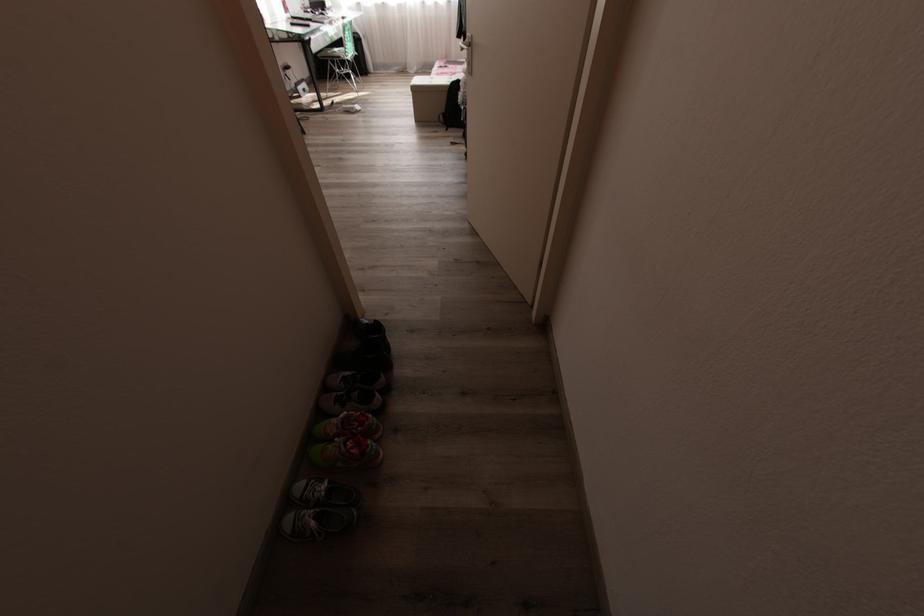
The height and width of the screenshot is (616, 924). Describe the element at coordinates (465, 44) in the screenshot. I see `a silver door handle` at that location.